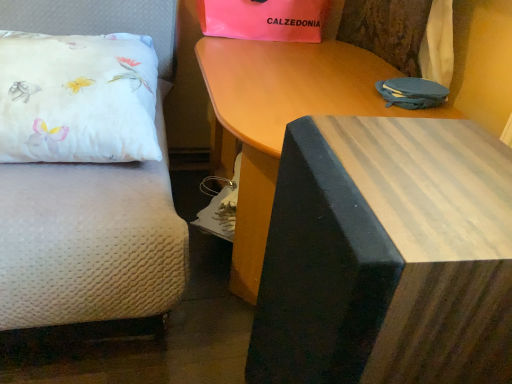
I want to click on free location above wooden table at center, the second table viewed from the back (from a real-world perspective), so click(x=417, y=172).